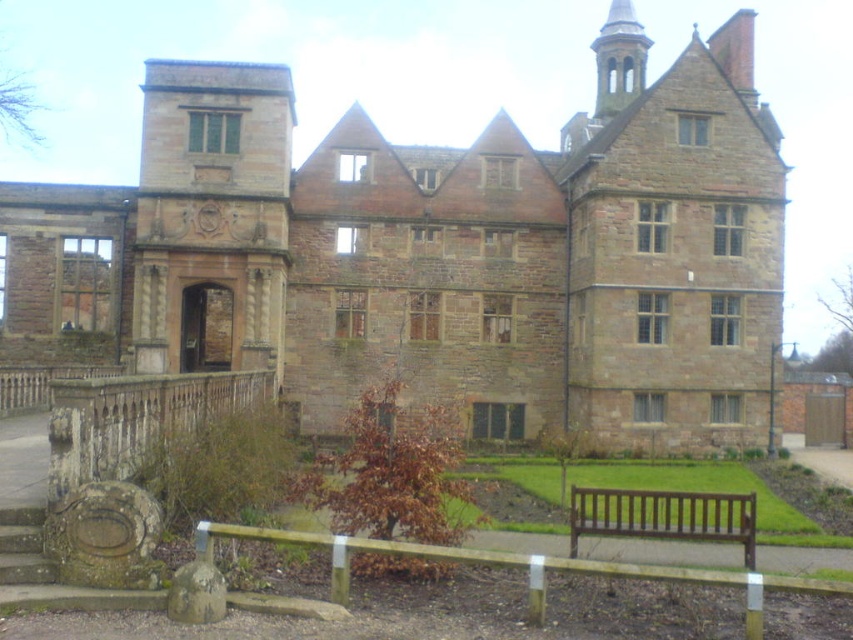
Is brown stone mansion at center to the left of brown wooden bench at lower center from the viewer's perspective?

Indeed, brown stone mansion at center is positioned on the left side of brown wooden bench at lower center.

Is brown stone mansion at center shorter than brown wooden bench at lower center?

No.

What do you see at coordinates (444, 252) in the screenshot? I see `brown stone mansion at center` at bounding box center [444, 252].

Image resolution: width=853 pixels, height=640 pixels. What are the coordinates of `brown stone mansion at center` in the screenshot? It's located at (444, 252).